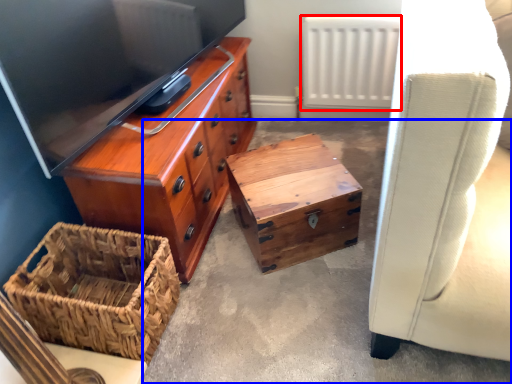
Question: Among these objects, which one is nearest to the camera, radiator (highlighted by a red box) or concrete (highlighted by a blue box)?

Choices:
 (A) radiator
 (B) concrete

Answer: (B)